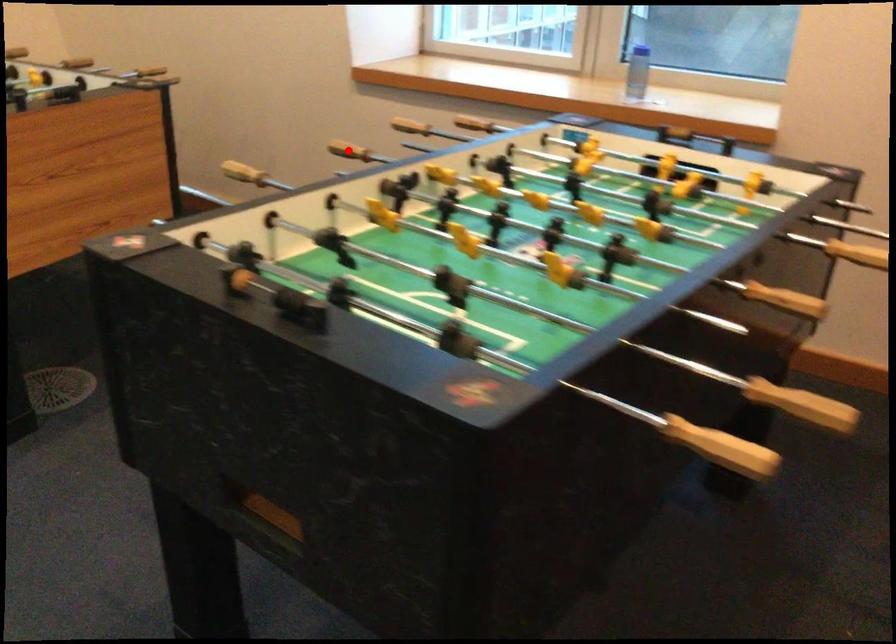
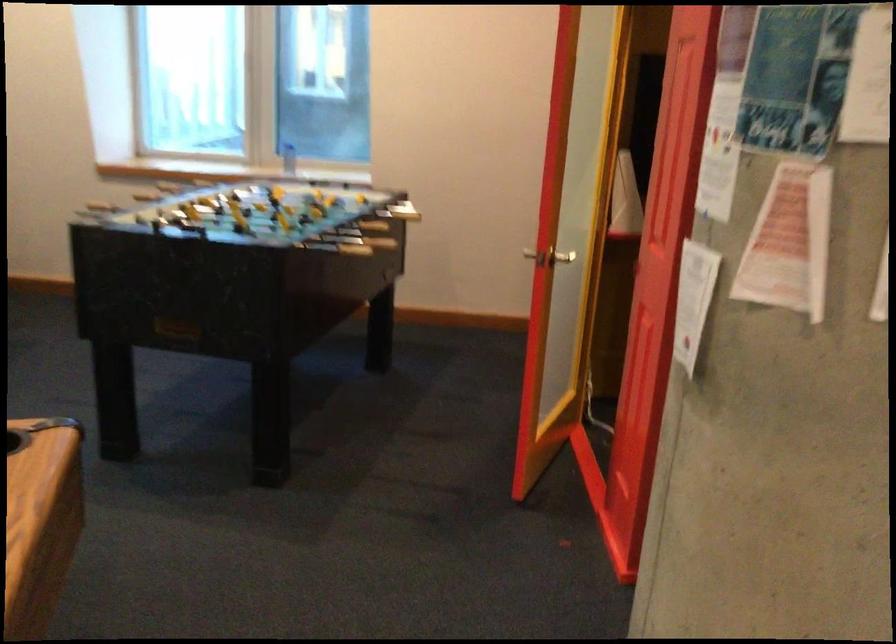
Question: I am providing you with two images of the same scene from different viewpoints. In image1, a red point is highlighted. Considering the same 3D point in image2, which of the following is correct?

Choices:
 (A) It is closer
 (B) It is farther

Answer: (B)